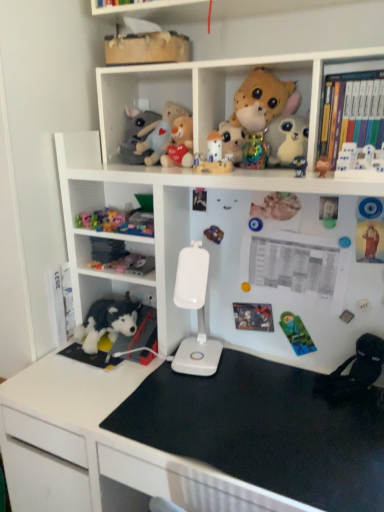
Question: Is brown plush bear at upper right, the eighth toy in the bottom-to-top sequence, not close to soft plush toy at upper center, the fourteenth toy ordered from the bottom?

Choices:
 (A) yes
 (B) no

Answer: (B)

Question: Is soft plush toy at upper center, the fourteenth toy ordered from the bottom, at the back of brown plush bear at upper right, positioned as the eighth toy in top-to-bottom order?

Choices:
 (A) no
 (B) yes

Answer: (A)

Question: Does brown plush bear at upper right, positioned as the eighth toy in top-to-bottom order, appear on the left side of soft plush toy at upper center, acting as the 2th toy starting from the top?

Choices:
 (A) no
 (B) yes

Answer: (A)

Question: Is brown plush bear at upper right, positioned as the eighth toy in top-to-bottom order, to the right of soft plush toy at upper center, acting as the 2th toy starting from the top, from the viewer's perspective?

Choices:
 (A) no
 (B) yes

Answer: (B)

Question: Is brown plush bear at upper right, the eighth toy in the bottom-to-top sequence, not inside soft plush toy at upper center, the fourteenth toy ordered from the bottom?

Choices:
 (A) yes
 (B) no

Answer: (A)

Question: Could soft plush toy at upper center, acting as the 2th toy starting from the top, be considered to be inside brown plush bear at upper right, the eighth toy in the bottom-to-top sequence?

Choices:
 (A) yes
 (B) no

Answer: (B)

Question: Could you tell me if wooden toy at upper center, acting as the fifteenth toy starting from the bottom, is turned towards metallic shiny toy at center, marked as the third toy in a bottom-to-top arrangement?

Choices:
 (A) yes
 (B) no

Answer: (B)

Question: Can we say wooden toy at upper center, acting as the fifteenth toy starting from the bottom, lies outside metallic shiny toy at center, marked as the third toy in a bottom-to-top arrangement?

Choices:
 (A) yes
 (B) no

Answer: (A)

Question: Is wooden toy at upper center, acting as the fifteenth toy starting from the bottom, taller than metallic shiny toy at center, marked as the third toy in a bottom-to-top arrangement?

Choices:
 (A) no
 (B) yes

Answer: (B)

Question: Is wooden toy at upper center, acting as the fifteenth toy starting from the bottom, at the left side of metallic shiny toy at center, the 13th toy in the top-to-bottom sequence?

Choices:
 (A) yes
 (B) no

Answer: (A)

Question: Is wooden toy at upper center, acting as the fifteenth toy starting from the bottom, not close to metallic shiny toy at center, the 13th toy in the top-to-bottom sequence?

Choices:
 (A) yes
 (B) no

Answer: (B)

Question: Considering the relative sizes of wooden toy at upper center, arranged as the first toy when viewed from the top, and metallic shiny toy at center, marked as the third toy in a bottom-to-top arrangement, in the image provided, is wooden toy at upper center, arranged as the first toy when viewed from the top, thinner than metallic shiny toy at center, marked as the third toy in a bottom-to-top arrangement,?

Choices:
 (A) no
 (B) yes

Answer: (A)

Question: Is matte gray plush at upper center, the thirteenth toy positioned from the bottom, further to camera compared to white plastic bookcase at upper center?

Choices:
 (A) no
 (B) yes

Answer: (B)